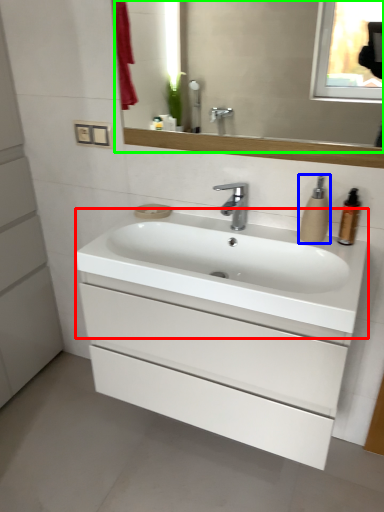
Question: Based on their relative distances, which object is farther from counter top (highlighted by a red box)? Choose from soap dispenser (highlighted by a blue box) and mirror (highlighted by a green box).

Choices:
 (A) soap dispenser
 (B) mirror

Answer: (B)